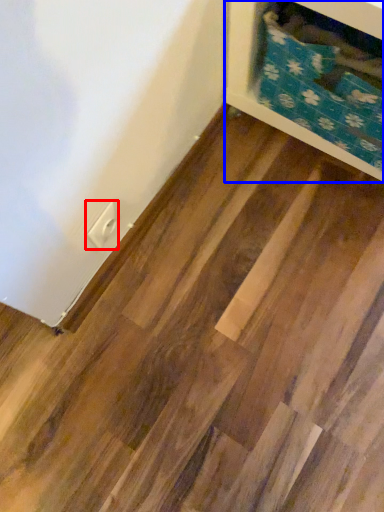
Question: Which object is further to the camera taking this photo, electric outlet (highlighted by a red box) or furniture (highlighted by a blue box)?

Choices:
 (A) electric outlet
 (B) furniture

Answer: (A)